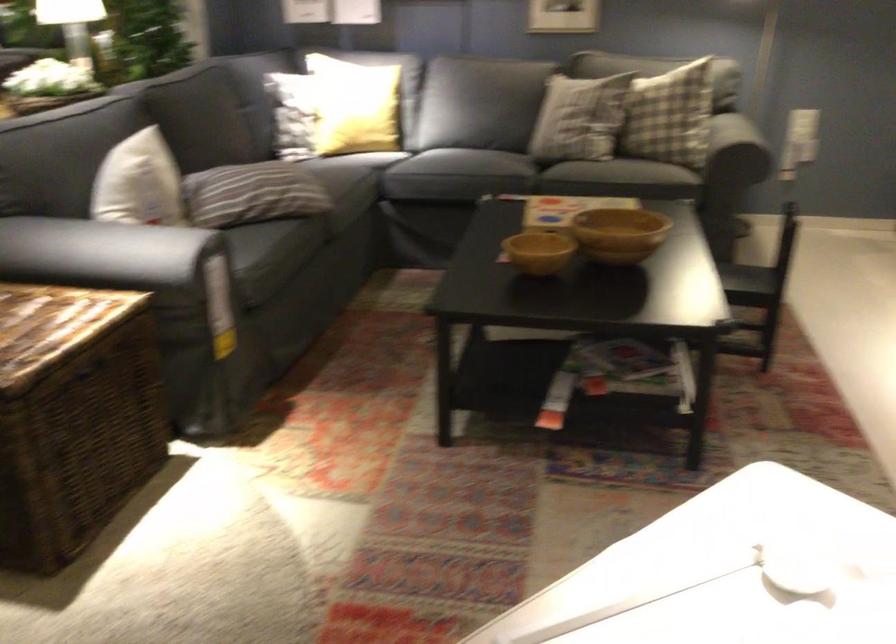
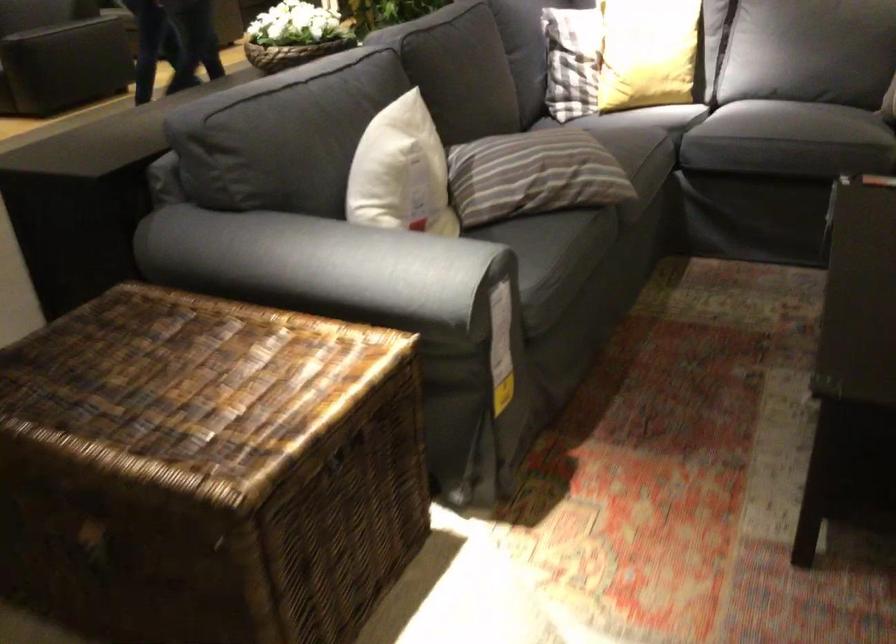
Locate, in the second image, the point that corresponds to [350,108] in the first image.

(647, 53)